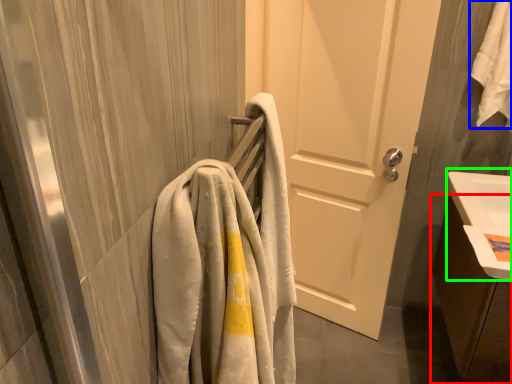
Question: Estimate the real-world distances between objects in this image. Which object is closer to bathroom cabinet (highlighted by a red box), bath towel (highlighted by a blue box) or sink (highlighted by a green box)?

Choices:
 (A) bath towel
 (B) sink

Answer: (B)